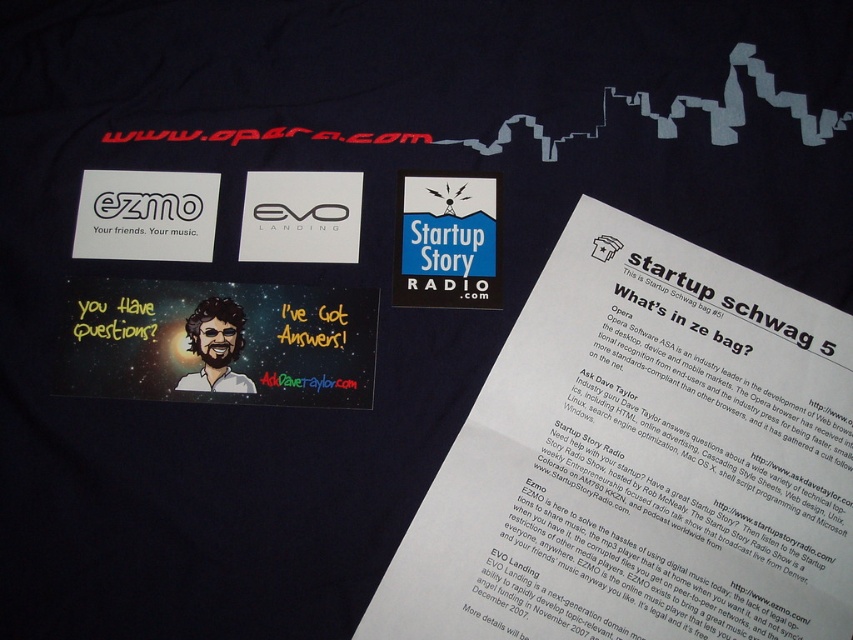
Question: Which object is closer to the camera taking this photo?

Choices:
 (A) cartoon character sticker at center
 (B) blue paper sticker at center

Answer: (A)

Question: Observing the image, what is the correct spatial positioning of blue paper at center in reference to blue paper sticker at center?

Choices:
 (A) left
 (B) right

Answer: (B)

Question: Based on their relative distances, which object is nearer to the blue paper at center?

Choices:
 (A) blue paper sticker at center
 (B) cartoon character sticker at center

Answer: (A)

Question: Does blue paper sticker at center appear over cartoon character sticker at center?

Choices:
 (A) yes
 (B) no

Answer: (A)

Question: Is blue paper at center to the right of blue paper sticker at center from the viewer's perspective?

Choices:
 (A) yes
 (B) no

Answer: (A)

Question: Which of the following is the farthest from the observer?

Choices:
 (A) (206, 307)
 (B) (456, 186)
 (C) (790, 385)

Answer: (B)